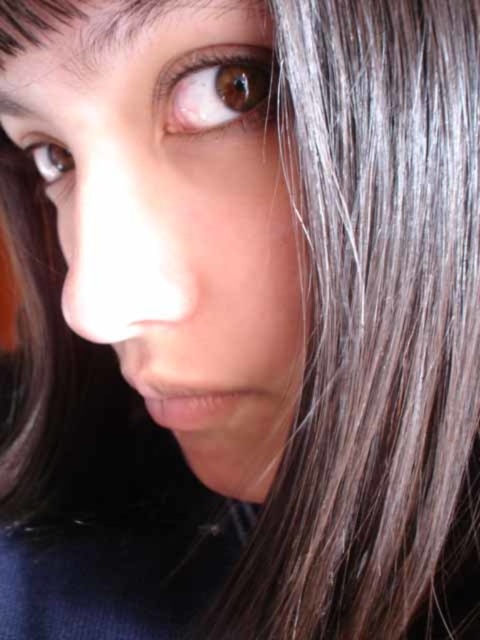
Question: Can you confirm if brown matte eye at upper center is wider than brown glossy eye at upper left?

Choices:
 (A) yes
 (B) no

Answer: (A)

Question: Is brown matte eye at upper center to the right of brown glossy eye at upper left from the viewer's perspective?

Choices:
 (A) yes
 (B) no

Answer: (A)

Question: Which object appears farthest from the camera in this image?

Choices:
 (A) brown glossy eye at upper left
 (B) brown matte eye at upper center

Answer: (A)

Question: Among these points, which one is nearest to the camera?

Choices:
 (A) (64, 161)
 (B) (182, 113)

Answer: (B)

Question: Observing the image, what is the correct spatial positioning of brown matte eye at upper center in reference to brown glossy eye at upper left?

Choices:
 (A) above
 (B) below

Answer: (A)

Question: Which point is farther to the camera?

Choices:
 (A) brown matte eye at upper center
 (B) brown glossy eye at upper left

Answer: (B)